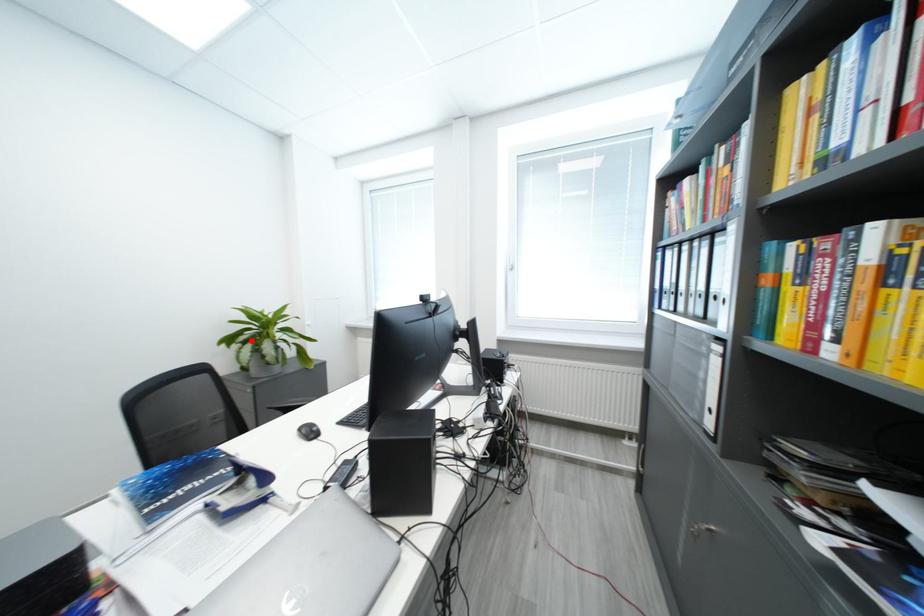
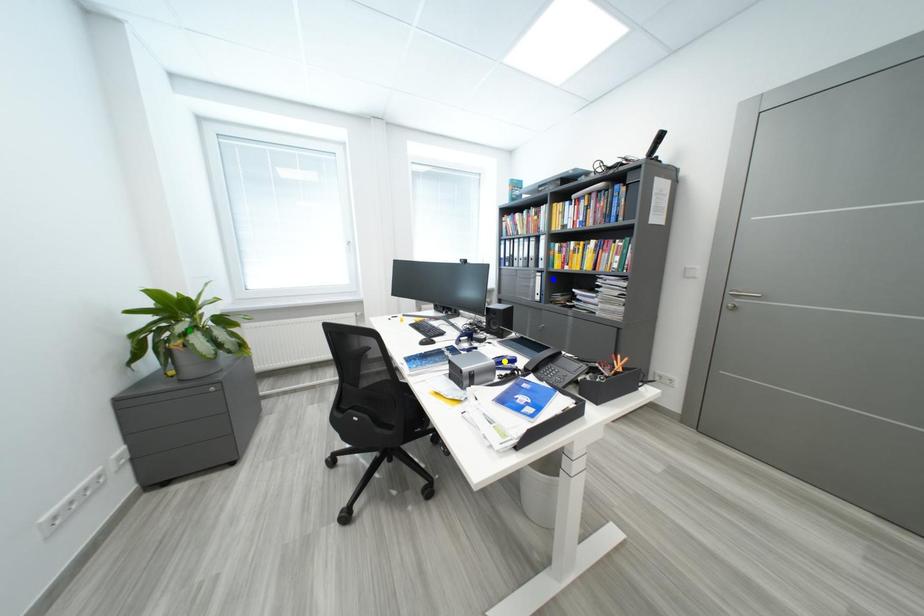
Question: I am providing you with two images of the same scene from different viewpoints. A red point is marked on the first image. You are given multiple points on the second image. Can you choose the point in image 2 that corresponds to the point in image 1?

Choices:
 (A) green point
 (B) blue point
 (C) yellow point

Answer: (A)